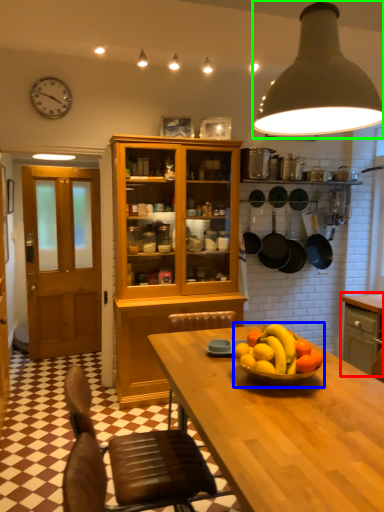
Question: Which object is positioned farthest from cabinetry (highlighted by a red box)? Select from fruit dish (highlighted by a blue box) and light (highlighted by a green box).

Choices:
 (A) fruit dish
 (B) light

Answer: (B)